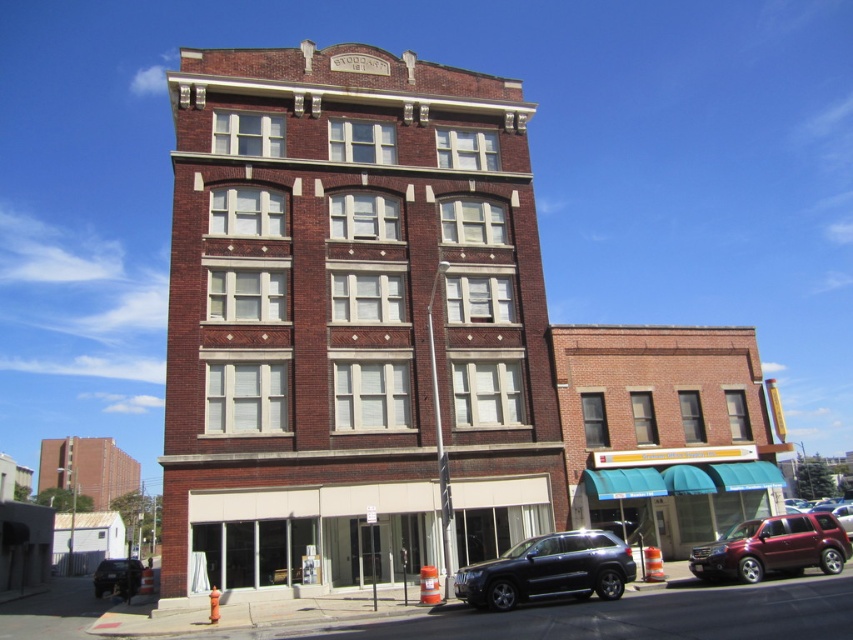
Which is more to the right, black matte suv at lower center or satin burgundy suv at lower right?

Positioned to the right is satin burgundy suv at lower right.

Does black matte suv at lower center have a smaller size compared to satin burgundy suv at lower right?

Yes.

Which is behind, point (491, 595) or point (831, 528)?

Positioned behind is point (831, 528).

The height and width of the screenshot is (640, 853). I want to click on black matte suv at lower center, so click(x=549, y=570).

Does satin burgundy suv at lower right have a lesser height compared to matte black suv at lower left?

Yes, satin burgundy suv at lower right is shorter than matte black suv at lower left.

Is satin burgundy suv at lower right in front of matte black suv at lower left?

Yes, it is.

This screenshot has width=853, height=640. What are the coordinates of `satin burgundy suv at lower right` in the screenshot? It's located at [x=773, y=547].

Is point (619, 573) positioned in front of point (128, 579)?

Yes.

Which is behind, point (589, 552) or point (120, 576)?

The point (120, 576) is behind.

At what (x,y) coordinates should I click in order to perform the action: click on black matte suv at lower center. Please return your answer as a coordinate pair (x, y). Looking at the image, I should click on (549, 570).